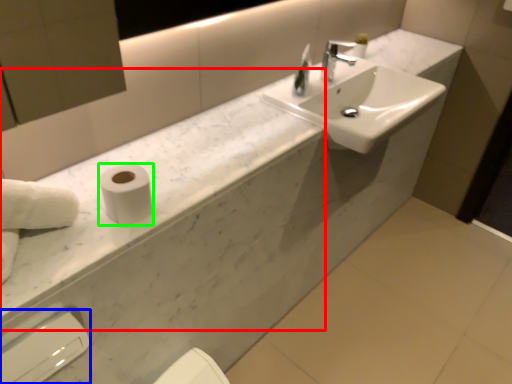
Question: Which is farther away from counter top (highlighted by a red box)? hand dryer (highlighted by a blue box) or toilet paper (highlighted by a green box)?

Choices:
 (A) hand dryer
 (B) toilet paper

Answer: (A)